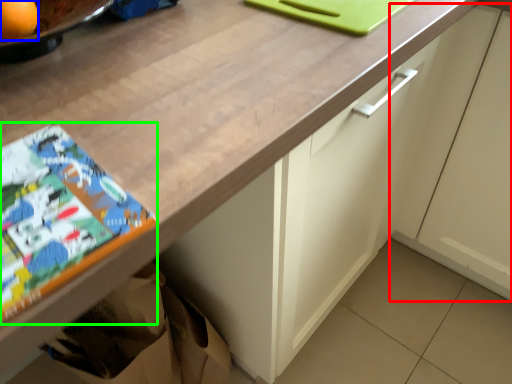
Question: Which object is positioned closest to cabinetry (highlighted by a red box)? Select from orange (highlighted by a blue box) and comic book (highlighted by a green box).

Choices:
 (A) orange
 (B) comic book

Answer: (B)